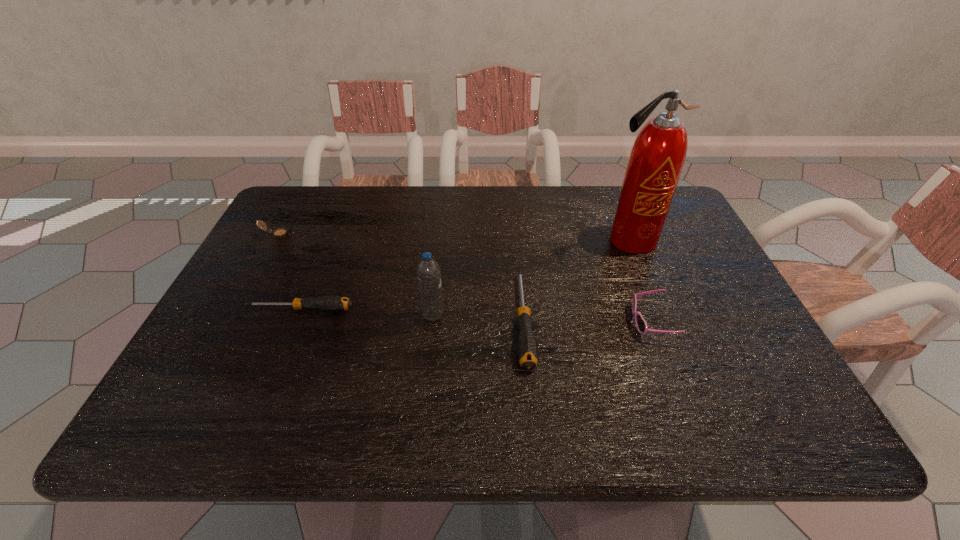
The width and height of the screenshot is (960, 540). In order to click on vacant space in between the sunglasses and the tallest object in this screenshot , I will do `click(639, 281)`.

Image resolution: width=960 pixels, height=540 pixels. In order to click on free spot between the fifth shortest object and the compass in this screenshot , I will do `click(355, 275)`.

Find the location of `free space between the fire extinguisher and the fourth object from left to right`. free space between the fire extinguisher and the fourth object from left to right is located at coordinates (576, 280).

Find the location of a particular element. unoccupied area between the tallest object and the third object from right to left is located at coordinates (576, 280).

Find the location of `unoccupied position between the third object from left to right and the compass`. unoccupied position between the third object from left to right and the compass is located at coordinates (355, 275).

In order to click on vacant region between the shorter screwdriver and the taller screwdriver in this screenshot , I will do `click(412, 315)`.

You are a GUI agent. You are given a task and a screenshot of the screen. Output one action in this format:
    pyautogui.click(x=<x>, y=<y>)
    Task: Click on the vacant space that is in between the sunglasses and the compass
    
    Given the screenshot: What is the action you would take?
    pyautogui.click(x=465, y=278)

At what (x,y) coordinates should I click in order to perform the action: click on free area in between the left screwdriver and the right screwdriver. Please return your answer as a coordinate pair (x, y). The height and width of the screenshot is (540, 960). Looking at the image, I should click on (412, 315).

Image resolution: width=960 pixels, height=540 pixels. Find the location of `vacant space that is in between the tallest object and the taller screwdriver`. vacant space that is in between the tallest object and the taller screwdriver is located at coordinates (576, 280).

Find the location of a particular element. The height and width of the screenshot is (540, 960). the second closest object to the tallest object is located at coordinates 527,350.